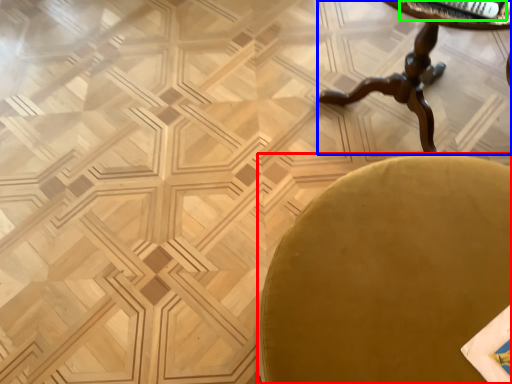
Question: Which object is the closest to the chair (highlighted by a red box)? Choose among these: table (highlighted by a blue box) or magazine (highlighted by a green box).

Choices:
 (A) table
 (B) magazine

Answer: (B)